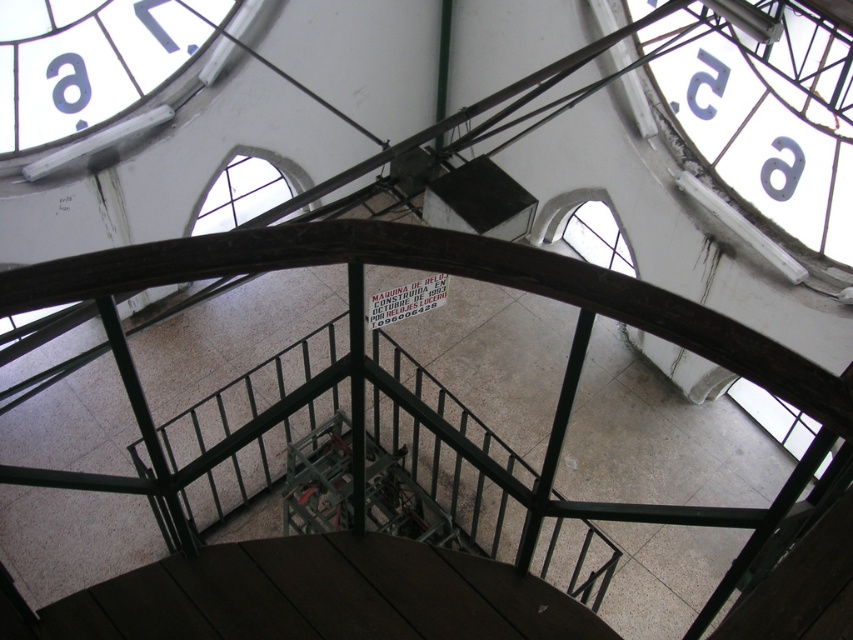
Is white glossy clock at upper left above black matte number at upper left?

No.

Locate an element on the screen. white glossy clock at upper left is located at coordinates (85, 61).

Where is `white glossy clock at upper left`? The width and height of the screenshot is (853, 640). white glossy clock at upper left is located at coordinates [x=85, y=61].

Can you confirm if clear glass window at center is positioned above black matte letter at upper center?

No, clear glass window at center is not above black matte letter at upper center.

Can you confirm if clear glass window at center is thinner than black matte letter at upper center?

In fact, clear glass window at center might be wider than black matte letter at upper center.

Between point (589, 205) and point (779, 188), which one is positioned in front?

Point (779, 188) is in front.

Identify the location of clear glass window at center. (596, 237).

Can you confirm if white glossy clock at upper left is positioned above clear glass window at center?

Correct, white glossy clock at upper left is located above clear glass window at center.

Which of these two, white glossy clock at upper left or clear glass window at center, stands taller?

With more height is white glossy clock at upper left.

Which is in front, point (47, 6) or point (606, 257)?

Point (47, 6)

The width and height of the screenshot is (853, 640). Find the location of `white glossy clock at upper left`. white glossy clock at upper left is located at coordinates (85, 61).